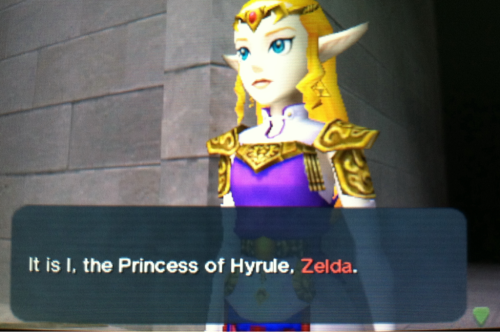
Where is `grey brick walls`? The height and width of the screenshot is (332, 500). grey brick walls is located at coordinates (113, 118), (391, 87).